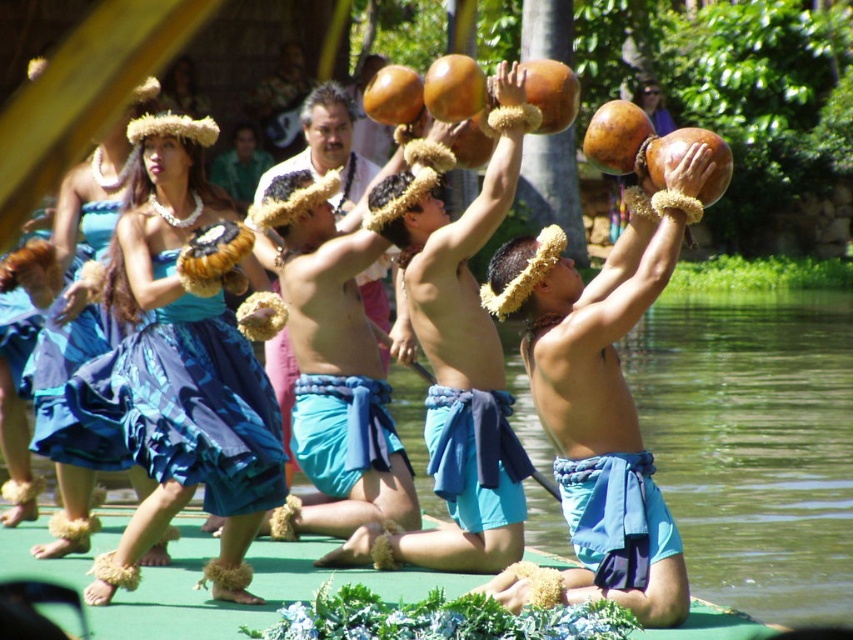
You are a photographer planning to capture a closeup shot of the coconut shells in the scene. Given that the matte coconut shell at upper center is smaller in width than the smooth brown coconut at center, which one would require you to stand closer to get a detailed shot without zooming?

The matte coconut shell at upper center has a lesser width compared to the smooth brown coconut at center, so you would need to stand closer to the matte coconut shell at upper center to capture its details without zooming.

You are a photographer at the back of the crowd, trying to capture a clear photo of the smooth brown coconut at center and the blue satin dress at center. Based on their heights, which object will be more visible in your photo?

The smooth brown coconut at center will be more visible in the photo because it has a greater height compared to the blue satin dress at center, making it stand out more in the frame.

Based on the scene description, where is the smooth brown coconut at center located in terms of coordinates?

The smooth brown coconut at center is located at coordinates point (456,360).